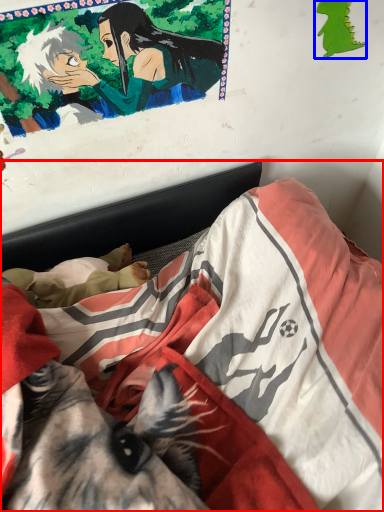
Question: Which of the following is the farthest to the observer, bed (highlighted by a red box) or art (highlighted by a blue box)?

Choices:
 (A) bed
 (B) art

Answer: (B)